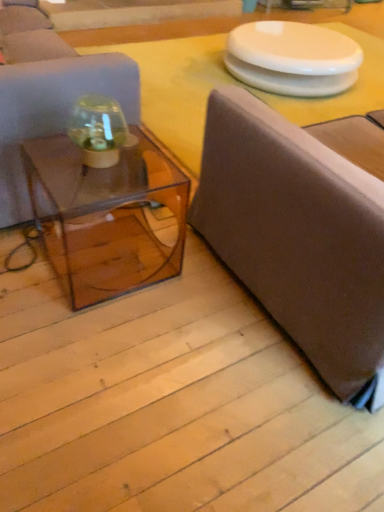
The image size is (384, 512). In order to click on transparent acrylic coffee table at center in this screenshot , I will do `click(106, 216)`.

Describe the element at coordinates (297, 236) in the screenshot. I see `matte gray studio couch at right, the 1th studio couch positioned from the right` at that location.

The width and height of the screenshot is (384, 512). I want to click on transparent glass table at center, so click(x=177, y=88).

This screenshot has width=384, height=512. What do you see at coordinates (292, 58) in the screenshot?
I see `white glossy round table at upper center` at bounding box center [292, 58].

Find the location of a particular element. This screenshot has width=384, height=512. matte brown couch at left, the 2th studio couch viewed from the right is located at coordinates (47, 95).

From the image's perspective, between transparent glass table at center and transparent acrylic coffee table at center, which one is located above?

transparent glass table at center is shown above in the image.

Considering the sizes of objects transparent glass table at center and transparent acrylic coffee table at center in the image provided, who is wider, transparent glass table at center or transparent acrylic coffee table at center?

Wider between the two is transparent glass table at center.

Does point (157, 114) appear closer or farther from the camera than point (59, 181)?

Clearly, point (157, 114) is more distant from the camera than point (59, 181).

Measure the distance between matte gray studio couch at right, which appears as the 2th studio couch when viewed from the left, and matte brown couch at left, marked as the 1th studio couch in a left-to-right arrangement.

matte gray studio couch at right, which appears as the 2th studio couch when viewed from the left, and matte brown couch at left, marked as the 1th studio couch in a left-to-right arrangement, are 29.11 inches apart.

Where is `studio couch that appears below the matte brown couch at left, the 2th studio couch viewed from the right (from a real-world perspective)`? The width and height of the screenshot is (384, 512). studio couch that appears below the matte brown couch at left, the 2th studio couch viewed from the right (from a real-world perspective) is located at coordinates (297, 236).

Considering the positions of objects matte gray studio couch at right, which appears as the 2th studio couch when viewed from the left, and matte brown couch at left, marked as the 1th studio couch in a left-to-right arrangement, in the image provided, who is more to the left, matte gray studio couch at right, which appears as the 2th studio couch when viewed from the left, or matte brown couch at left, marked as the 1th studio couch in a left-to-right arrangement,?

From the viewer's perspective, matte brown couch at left, marked as the 1th studio couch in a left-to-right arrangement, appears more on the left side.

Based on their sizes in the image, would you say matte gray studio couch at right, which appears as the 2th studio couch when viewed from the left, is bigger or smaller than matte brown couch at left, the 2th studio couch viewed from the right?

Considering their sizes, matte gray studio couch at right, which appears as the 2th studio couch when viewed from the left, takes up less space than matte brown couch at left, the 2th studio couch viewed from the right.

Is white glossy round table at upper center to the left of matte brown couch at left, marked as the 1th studio couch in a left-to-right arrangement, from the viewer's perspective?

In fact, white glossy round table at upper center is to the right of matte brown couch at left, marked as the 1th studio couch in a left-to-right arrangement.

Which of these two, white glossy round table at upper center or matte brown couch at left, marked as the 1th studio couch in a left-to-right arrangement, is wider?

With larger width is white glossy round table at upper center.

Is point (278, 76) positioned after point (64, 128)?

Yes, point (278, 76) is farther from viewer.

Is matte brown couch at left, the 2th studio couch viewed from the right, at the back of white glossy round table at upper center?

No, white glossy round table at upper center's orientation is not away from matte brown couch at left, the 2th studio couch viewed from the right.

From a real-world perspective, is transparent glass table at center positioned under transparent glass jar at center based on gravity?

Yes, from a real-world perspective, transparent glass table at center is beneath transparent glass jar at center.

Is transparent glass table at center shorter than transparent glass jar at center?

Yes.

Which object is closer to the camera taking this photo, transparent glass table at center or transparent glass jar at center?

transparent glass jar at center is more forward.

Is transparent acrylic coffee table at center aimed at transparent glass table at center?

No, transparent acrylic coffee table at center is not oriented towards transparent glass table at center.

Is the surface of transparent acrylic coffee table at center in direct contact with transparent glass table at center?

No.

Considering the sizes of objects transparent acrylic coffee table at center and transparent glass table at center in the image provided, who is thinner, transparent acrylic coffee table at center or transparent glass table at center?

Thinner between the two is transparent acrylic coffee table at center.

Consider the image. From the image's perspective, does transparent acrylic coffee table at center appear lower than transparent glass table at center?

Indeed, from the image's perspective, transparent acrylic coffee table at center is shown beneath transparent glass table at center.

Measure the distance from transparent acrylic coffee table at center to matte brown couch at left, marked as the 1th studio couch in a left-to-right arrangement.

A distance of 32.95 centimeters exists between transparent acrylic coffee table at center and matte brown couch at left, marked as the 1th studio couch in a left-to-right arrangement.

From the image's perspective, which one is positioned higher, transparent acrylic coffee table at center or matte brown couch at left, marked as the 1th studio couch in a left-to-right arrangement?

From the image's view, matte brown couch at left, marked as the 1th studio couch in a left-to-right arrangement, is above.

Locate an element on the screen. Image resolution: width=384 pixels, height=512 pixels. coffee table lying on the right of matte brown couch at left, the 2th studio couch viewed from the right is located at coordinates (106, 216).

Which is behind, transparent acrylic coffee table at center or matte brown couch at left, the 2th studio couch viewed from the right?

Positioned behind is matte brown couch at left, the 2th studio couch viewed from the right.

Considering the relative sizes of transparent glass jar at center and transparent acrylic coffee table at center in the image provided, is transparent glass jar at center thinner than transparent acrylic coffee table at center?

Indeed, transparent glass jar at center has a lesser width compared to transparent acrylic coffee table at center.

From a real-world perspective, which is physically below, transparent glass jar at center or transparent acrylic coffee table at center?

transparent acrylic coffee table at center, from a real-world perspective.

Between transparent glass jar at center and transparent acrylic coffee table at center, which one has larger size?

transparent acrylic coffee table at center is bigger.

Which point is more forward, (97,140) or (188,184)?

The point (97,140) is in front.

Identify the location of table top below the transparent acrylic coffee table at center (from a real-world perspective). (177, 88).

This screenshot has height=512, width=384. Identify the location of studio couch above the matte gray studio couch at right, the 1th studio couch positioned from the right (from a real-world perspective). (47, 95).

Based on their spatial positions, is transparent acrylic coffee table at center or transparent glass jar at center further from matte gray studio couch at right, which appears as the 2th studio couch when viewed from the left?

transparent glass jar at center is further to matte gray studio couch at right, which appears as the 2th studio couch when viewed from the left.

From the image, which object appears to be nearer to white glossy round table at upper center, transparent acrylic coffee table at center or transparent glass jar at center?

transparent acrylic coffee table at center is closer to white glossy round table at upper center.

When comparing their distances from transparent glass table at center, does matte brown couch at left, marked as the 1th studio couch in a left-to-right arrangement, or transparent acrylic coffee table at center seem closer?

transparent acrylic coffee table at center is closer to transparent glass table at center.

Based on their spatial positions, is matte brown couch at left, marked as the 1th studio couch in a left-to-right arrangement, or transparent glass jar at center closer to white glossy round table at upper center?

The object closer to white glossy round table at upper center is matte brown couch at left, marked as the 1th studio couch in a left-to-right arrangement.

Based on their spatial positions, is white glossy round table at upper center or transparent glass table at center further from matte gray studio couch at right, the 1th studio couch positioned from the right?

white glossy round table at upper center.

Based on their spatial positions, is transparent glass table at center or matte gray studio couch at right, which appears as the 2th studio couch when viewed from the left, further from white glossy round table at upper center?

matte gray studio couch at right, which appears as the 2th studio couch when viewed from the left, is further to white glossy round table at upper center.

Estimate the real-world distances between objects in this image. Which object is closer to transparent glass table at center, matte brown couch at left, marked as the 1th studio couch in a left-to-right arrangement, or white glossy round table at upper center?

Based on the image, white glossy round table at upper center appears to be nearer to transparent glass table at center.

Based on their spatial positions, is white glossy round table at upper center or matte brown couch at left, marked as the 1th studio couch in a left-to-right arrangement, further from transparent acrylic coffee table at center?

white glossy round table at upper center lies further to transparent acrylic coffee table at center than the other object.

Identify the location of glass vase between transparent acrylic coffee table at center and matte gray studio couch at right, the 1th studio couch positioned from the right, from left to right. (98, 130).

Identify the location of coffee table located between matte brown couch at left, marked as the 1th studio couch in a left-to-right arrangement, and matte gray studio couch at right, the 1th studio couch positioned from the right, in the left-right direction. (106, 216).

The width and height of the screenshot is (384, 512). I want to click on glass vase that lies between transparent glass table at center and transparent acrylic coffee table at center from top to bottom, so click(98, 130).

Identify the location of glass vase between matte brown couch at left, marked as the 1th studio couch in a left-to-right arrangement, and transparent glass table at center. This screenshot has height=512, width=384. (98, 130).